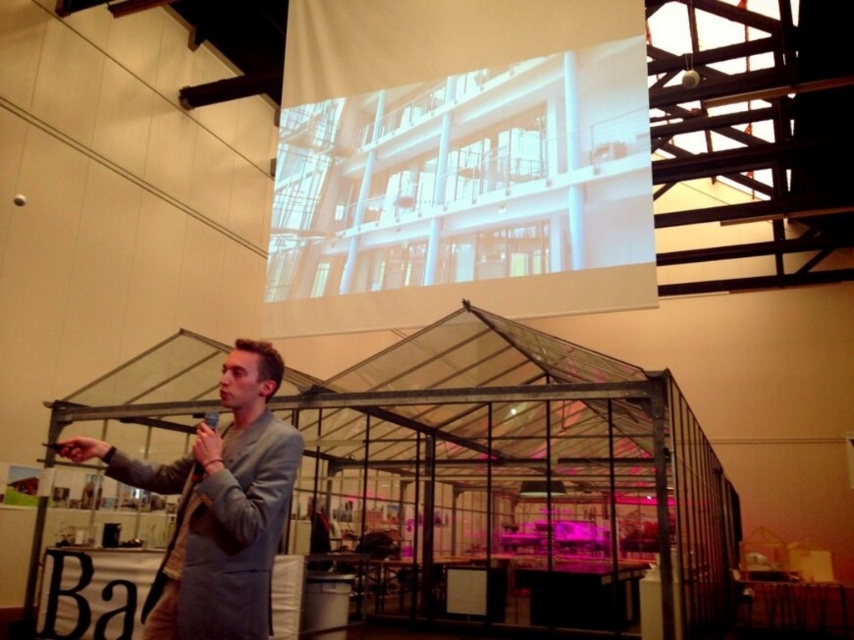
You are an event planner arranging the layout for a presentation. The white matte projection screen at upper center and the light gray suit at center are both in the room. Which object takes up more horizontal space?

The white matte projection screen at upper center takes up more horizontal space because its width surpasses that of the light gray suit at center.

You are attending a presentation and want to locate the exact point where the presenter is pointing. The presenter is standing at the left side of the room. Can you determine if the point marked as point (459, 163) is on the white matte projection screen at upper center?

Yes, the point (459, 163) is on the white matte projection screen at upper center, so the presenter is pointing towards that area.